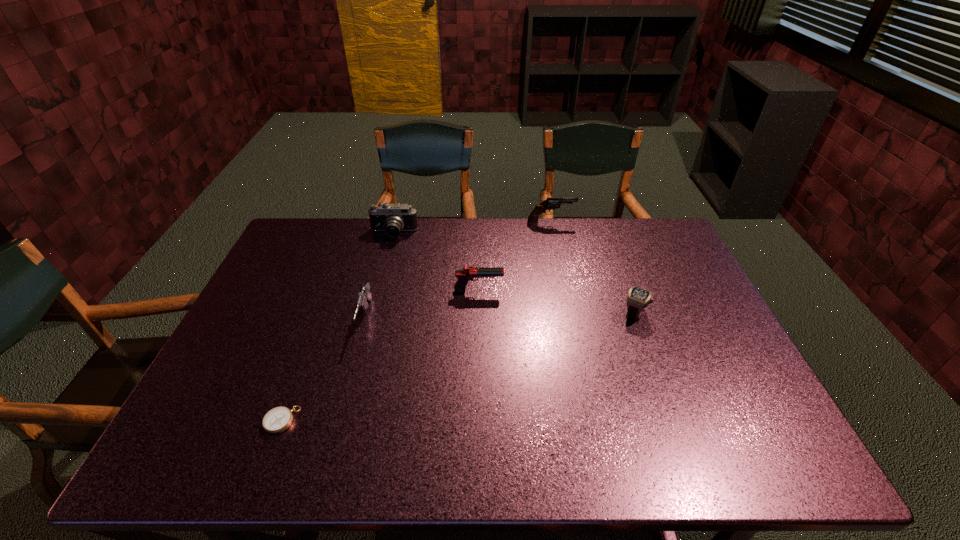
Identify the location of vacant space at the left edge of the desktop. (258, 377).

Where is `vacant region at the right edge of the desktop`? This screenshot has width=960, height=540. vacant region at the right edge of the desktop is located at coordinates (729, 360).

The image size is (960, 540). In order to click on vacant space at the far left corner of the desktop in this screenshot , I will do `click(296, 233)`.

Where is `vacant area that lies between the second farthest object and the shortest object`? Image resolution: width=960 pixels, height=540 pixels. vacant area that lies between the second farthest object and the shortest object is located at coordinates (338, 327).

Locate an element on the screen. vacant space that is in between the farthest gun and the rightmost object is located at coordinates (592, 268).

This screenshot has width=960, height=540. What are the coordinates of `unoccupied area between the shortest object and the tallest gun` in the screenshot? It's located at (416, 321).

This screenshot has width=960, height=540. In order to click on vacant area between the tallest gun and the second gun from right to left in this screenshot , I will do `click(515, 256)`.

At what (x,y) coordinates should I click in order to perform the action: click on free point between the watch and the nearest object. Please return your answer as a coordinate pair (x, y). Looking at the image, I should click on (458, 367).

The height and width of the screenshot is (540, 960). In order to click on free space between the third farthest object and the camera in this screenshot , I will do `click(436, 262)`.

The image size is (960, 540). I want to click on free area in between the fourth nearest object and the shortest object, so [x=380, y=355].